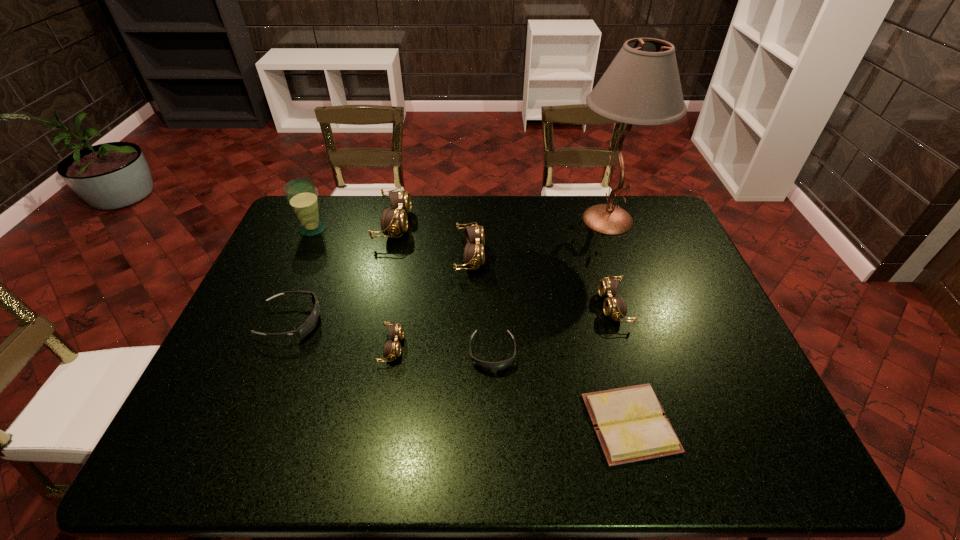
I want to click on free space located 0.350m through the lenses of the biggest brown goggles, so click(x=511, y=224).

Identify the location of free space located through the lenses of the fifth shortest goggles. The height and width of the screenshot is (540, 960). (525, 255).

Image resolution: width=960 pixels, height=540 pixels. Identify the location of free space located through the lenses of the rightmost brown goggles. (495, 306).

This screenshot has width=960, height=540. I want to click on free spot located through the lenses of the rightmost brown goggles, so click(x=538, y=306).

Identify the location of vacant space located through the lenses of the rightmost brown goggles. This screenshot has height=540, width=960. (583, 306).

Where is `vacant space located 0.200m on the lenses of the left black goggles`? This screenshot has width=960, height=540. vacant space located 0.200m on the lenses of the left black goggles is located at coordinates (394, 321).

At what (x,y) coordinates should I click in order to perform the action: click on vacant point located through the lenses of the smallest brown goggles. Please return your answer as a coordinate pair (x, y). Looking at the image, I should click on (487, 347).

Image resolution: width=960 pixels, height=540 pixels. I want to click on free space located on the lenses of the smaller black goggles, so click(x=493, y=406).

Where is `free spot located 0.200m on the right of the nearest object`? This screenshot has height=540, width=960. free spot located 0.200m on the right of the nearest object is located at coordinates (762, 423).

Identify the location of table lamp that is at the far edge. Image resolution: width=960 pixels, height=540 pixels. (642, 86).